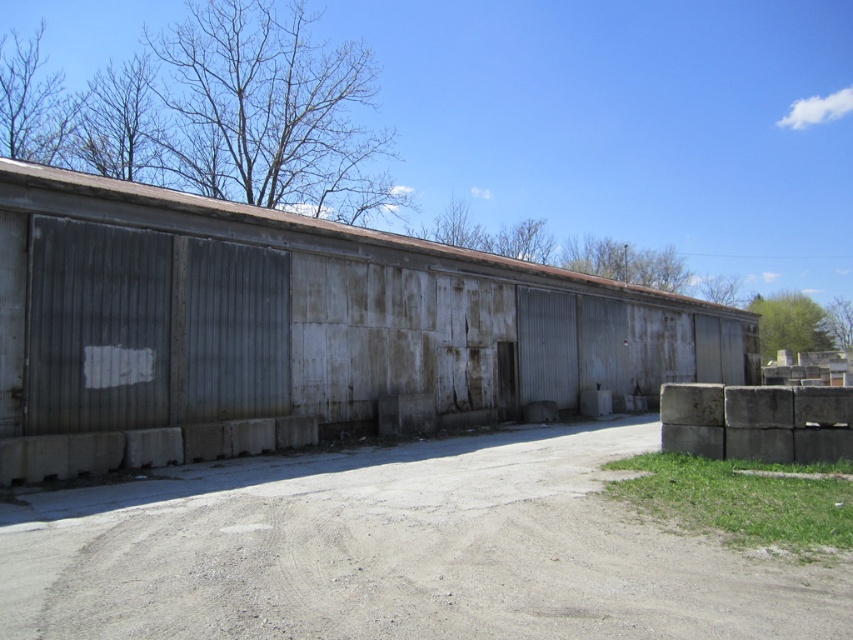
Does rusty corrugated metal shed at center lie behind gray gravel dirt track at center?

That is True.

Is rusty corrugated metal shed at center bigger than gray gravel dirt track at center?

Yes, rusty corrugated metal shed at center is bigger than gray gravel dirt track at center.

Is point (637, 307) farther from camera compared to point (439, 560)?

Yes, point (637, 307) is farther from viewer.

Where is `rusty corrugated metal shed at center`? The image size is (853, 640). rusty corrugated metal shed at center is located at coordinates (x=297, y=324).